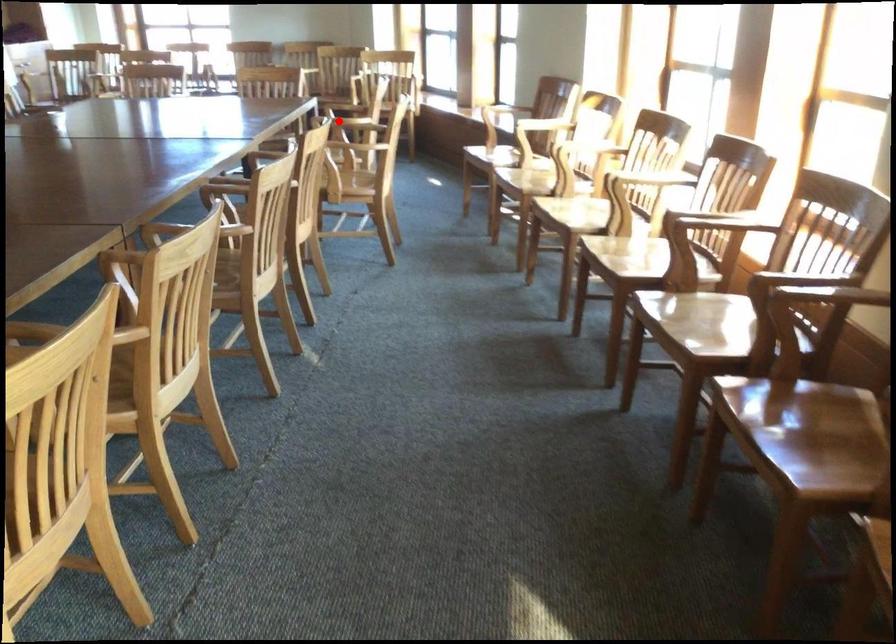
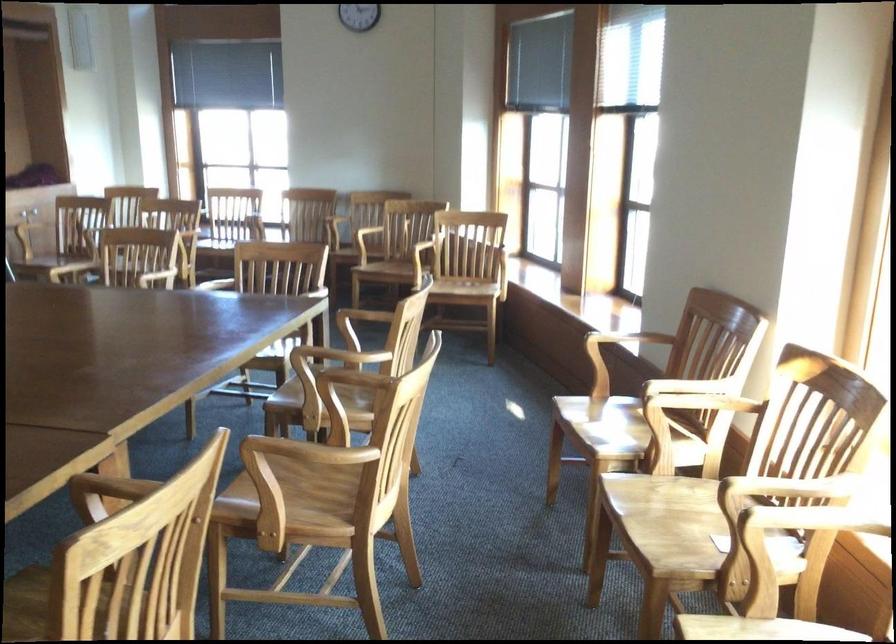
Locate, in the second image, the point that corresponds to the highlighted location in the first image.

(337, 357)